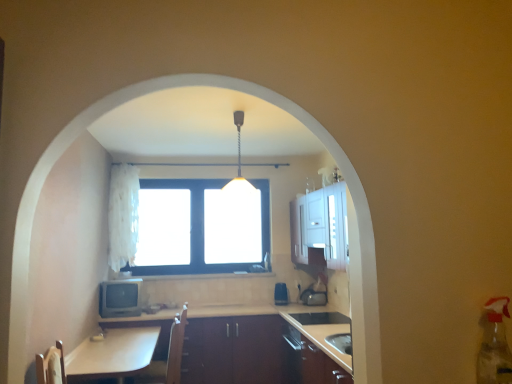
Locate an element on the screen. vacant space situated above metallic pendant light at center (from a real-world perspective) is located at coordinates (242, 110).